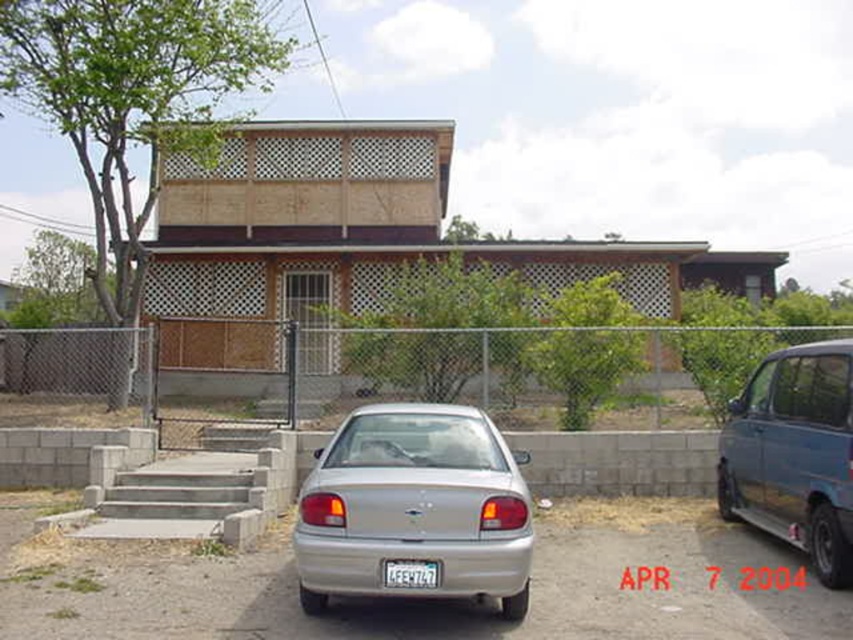
You are a delivery person needing to park your vehicle in the driveway. The driveway is directly in front of the house. The silver metallic sedan at center is blocking the entrance. Can you move your vehicle around the metallic blue minivan at right to access the driveway?

The silver metallic sedan at center is to the left of the metallic blue minivan at right, so you can move around the right side of the metallic blue minivan at right to access the driveway.